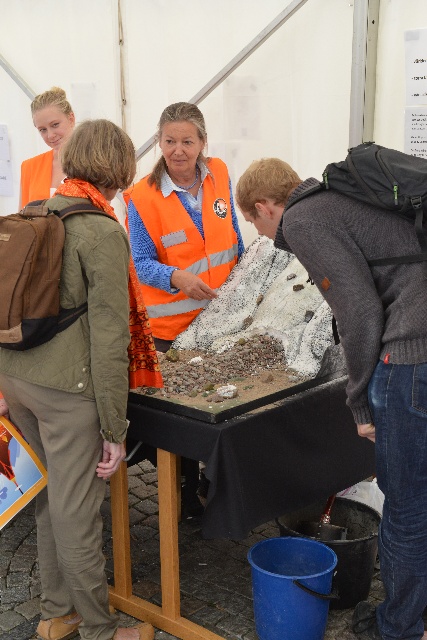
You are standing at the back of the scene and want to see the person in the matte orange vest at upper left. Is the knitted gray sweater at lower right blocking your view of them?

The knitted gray sweater at lower right is in front of the matte orange vest at upper left, so yes, it is blocking the view.

You are a participant at the event and want to place a 15 cm tall object on the black fabric table at center. The reflective orange safety vest at center is worn by an organizer standing nearby. Can the object be placed on the table without it being obstructed by the vest?

The black fabric table at center has a lesser height compared to the reflective orange safety vest at center, so the 15 cm tall object might be obstructed by the vest since the vest is taller than the table.

You are a visitor at this event and want to place a small gift on the table without getting too close to the safety vest. The gift requires 0.5 meters of space. Is the distance between the black fabric table at center and the reflective orange safety vest at center sufficient?

The black fabric table at center is 1.26 meters from the reflective orange safety vest at center. Since the required space is 0.5 meters, the distance is sufficient to place the gift without getting too close.